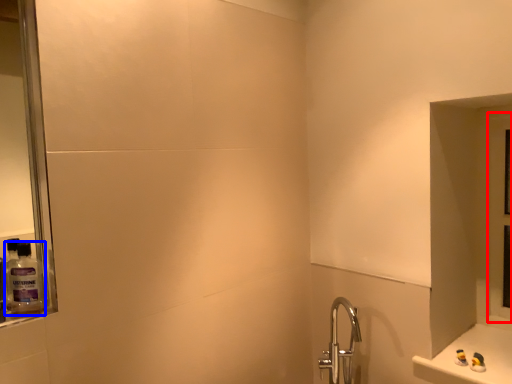
Question: Which object is closer to the camera taking this photo, glass door (highlighted by a red box) or mouthwash (highlighted by a blue box)?

Choices:
 (A) glass door
 (B) mouthwash

Answer: (B)